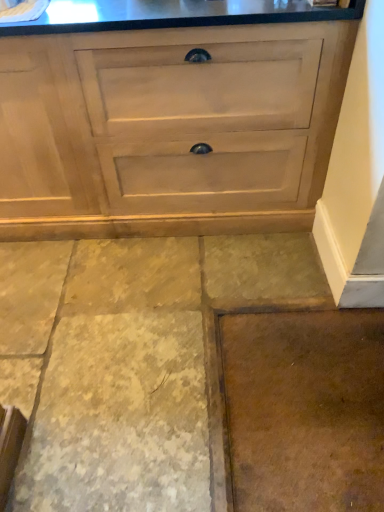
Question: Is brown matte concrete at lower right, the second concrete from the left, at the right side of matte wood chest of drawers at center?

Choices:
 (A) yes
 (B) no

Answer: (A)

Question: Is brown matte concrete at lower right, the 1th concrete in the right-to-left sequence, next to matte wood chest of drawers at center and touching it?

Choices:
 (A) no
 (B) yes

Answer: (A)

Question: From a real-world perspective, does brown matte concrete at lower right, the 1th concrete in the right-to-left sequence, sit lower than matte wood chest of drawers at center?

Choices:
 (A) no
 (B) yes

Answer: (B)

Question: Does brown matte concrete at lower right, the second concrete from the left, have a lesser width compared to matte wood chest of drawers at center?

Choices:
 (A) yes
 (B) no

Answer: (A)

Question: Does brown matte concrete at lower right, the 1th concrete in the right-to-left sequence, turn towards matte wood chest of drawers at center?

Choices:
 (A) no
 (B) yes

Answer: (A)

Question: Is brown matte concrete at lower right, the second concrete from the left, to the left of matte wood chest of drawers at center from the viewer's perspective?

Choices:
 (A) no
 (B) yes

Answer: (A)

Question: Can you confirm if matte wood chest of drawers at center is taller than brown matte concrete at lower right, the 1th concrete in the right-to-left sequence?

Choices:
 (A) yes
 (B) no

Answer: (A)

Question: Is matte wood chest of drawers at center to the right of brown matte concrete at lower right, the 1th concrete in the right-to-left sequence, from the viewer's perspective?

Choices:
 (A) no
 (B) yes

Answer: (A)

Question: From the image's perspective, is matte wood chest of drawers at center below brown matte concrete at lower right, the second concrete from the left?

Choices:
 (A) yes
 (B) no

Answer: (B)

Question: From the image's perspective, is matte wood chest of drawers at center located above brown matte concrete at lower right, the second concrete from the left?

Choices:
 (A) yes
 (B) no

Answer: (A)

Question: Can brown matte concrete at lower right, the second concrete from the left, be found inside matte wood chest of drawers at center?

Choices:
 (A) yes
 (B) no

Answer: (B)

Question: Would you consider matte wood chest of drawers at center to be distant from brown matte concrete at lower right, the second concrete from the left?

Choices:
 (A) no
 (B) yes

Answer: (A)

Question: Considering the relative sizes of brown stone floor at lower center, which ranks as the second concrete in right-to-left order, and matte wood chest of drawers at center in the image provided, is brown stone floor at lower center, which ranks as the second concrete in right-to-left order, shorter than matte wood chest of drawers at center?

Choices:
 (A) yes
 (B) no

Answer: (A)